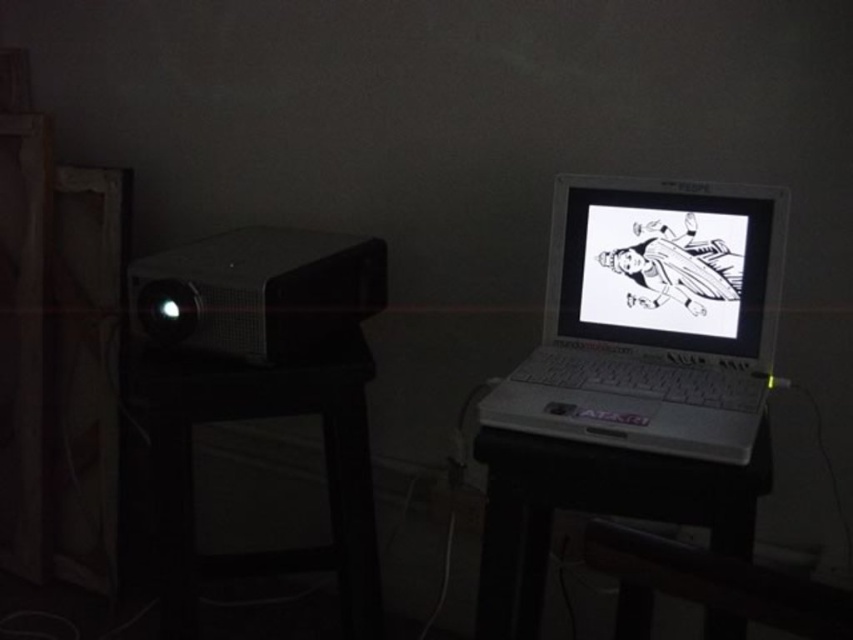
You are standing in the room and want to determine which of the two points, point [741,273] or point [575,310], is closer to you. Based on the scene, which point is nearer?

Point [741,273] is closer to the camera than point [575,310], so it is nearer to you.

You are setting up a presentation and need to position the white glossy screen at center so that it faces the white plastic table at center. Based on their positions, which object should be moved to align them properly?

The white glossy screen at center is to the right of the white plastic table at center. To align them properly, the white glossy screen at center should be moved to the left until it is centered in front of the white plastic table at center.